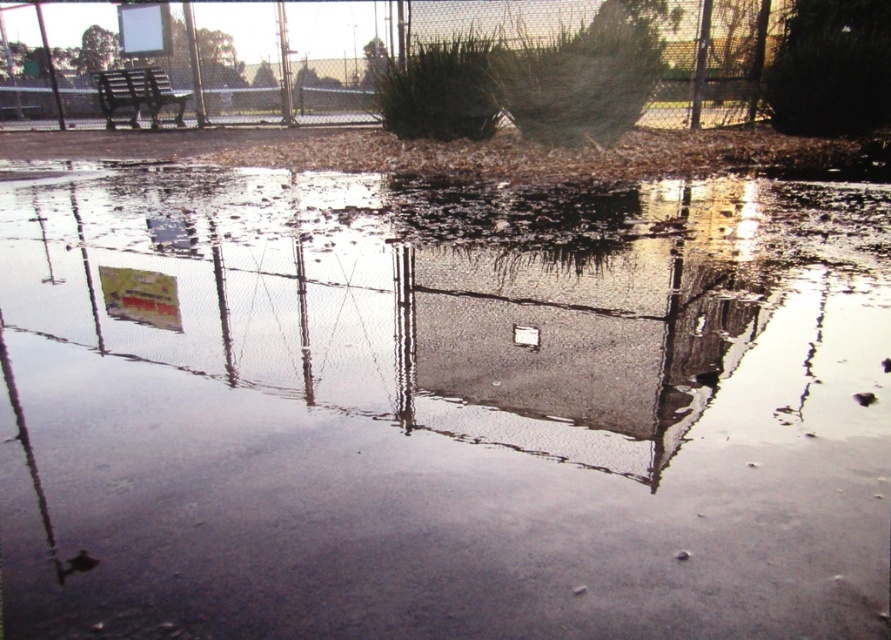
Is point (6, 29) closer to viewer compared to point (103, 115)?

That is False.

Can you confirm if metallic chain-link fence at upper center is shorter than metallic park bench at upper left?

Incorrect, metallic chain-link fence at upper center's height does not fall short of metallic park bench at upper left's.

Is point (184, 42) less distant than point (116, 76)?

Yes.

Where is `metallic chain-link fence at upper center`? This screenshot has height=640, width=891. metallic chain-link fence at upper center is located at coordinates (299, 60).